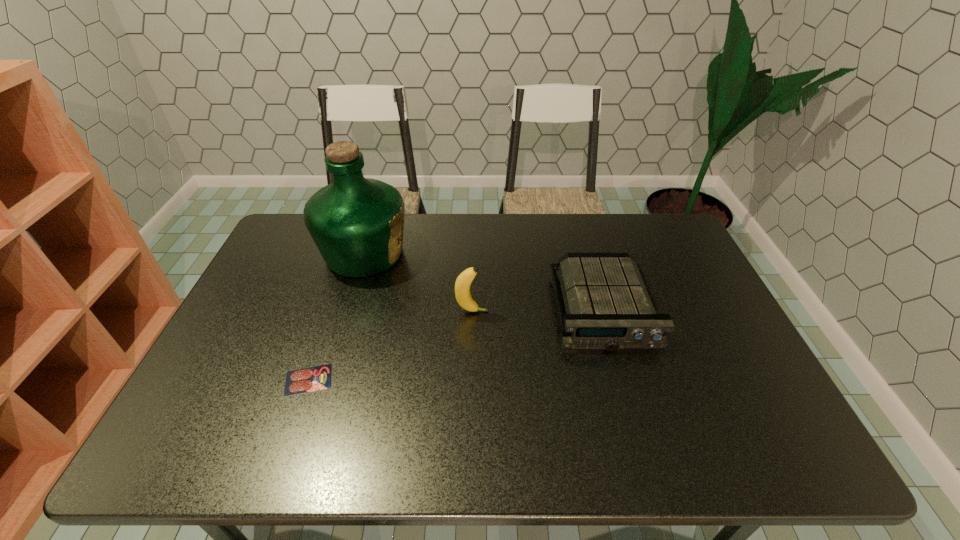
You are a GUI agent. You are given a task and a screenshot of the screen. Output one action in this format:
    pyautogui.click(x=<x>, y=<y>)
    Task: Click on the empty space between the liquor and the third shortest object
    
    Given the screenshot: What is the action you would take?
    419,282

Locate an element on the screen. The height and width of the screenshot is (540, 960). vacant point located between the third shortest object and the radio receiver is located at coordinates (538, 310).

Identify the location of vacant point located between the liquor and the second shortest object. Image resolution: width=960 pixels, height=540 pixels. (484, 281).

This screenshot has height=540, width=960. Identify the location of vacant space in between the second object from right to left and the salami. (391, 346).

You are a GUI agent. You are given a task and a screenshot of the screen. Output one action in this format:
    pyautogui.click(x=<x>, y=<y>)
    Task: Click on the empty space between the salami and the banana
    The height and width of the screenshot is (540, 960).
    Given the screenshot: What is the action you would take?
    pyautogui.click(x=391, y=346)

This screenshot has width=960, height=540. What are the coordinates of `free point between the nearest object and the second object from right to left` in the screenshot? It's located at (391, 346).

Locate an element on the screen. This screenshot has height=540, width=960. free spot between the third tallest object and the liquor is located at coordinates (484, 281).

You are a GUI agent. You are given a task and a screenshot of the screen. Output one action in this format:
    pyautogui.click(x=<x>, y=<y>)
    Task: Click on the blank region between the third tallest object and the tallest object
    Image resolution: width=960 pixels, height=540 pixels.
    Given the screenshot: What is the action you would take?
    pyautogui.click(x=484, y=281)

Locate an element on the screen. The width and height of the screenshot is (960, 540). free space between the rightmost object and the liquor is located at coordinates (484, 281).

I want to click on vacant space that's between the rightmost object and the liquor, so click(x=484, y=281).